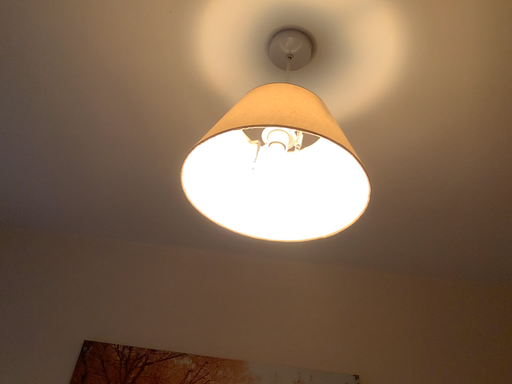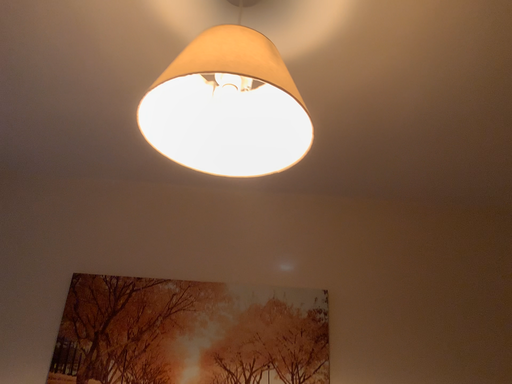
Question: Which way did the camera rotate in the video?

Choices:
 (A) rotated upward
 (B) rotated downward

Answer: (B)